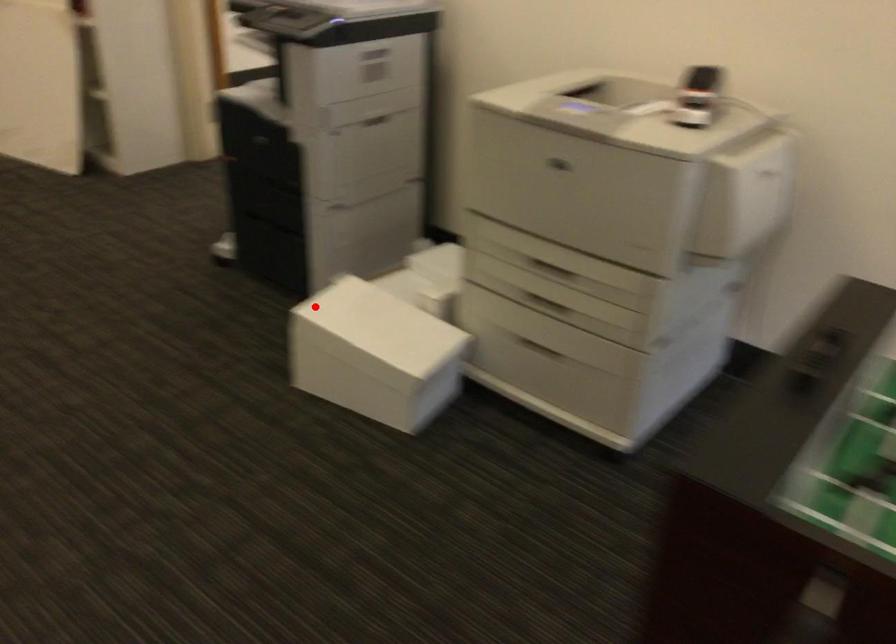
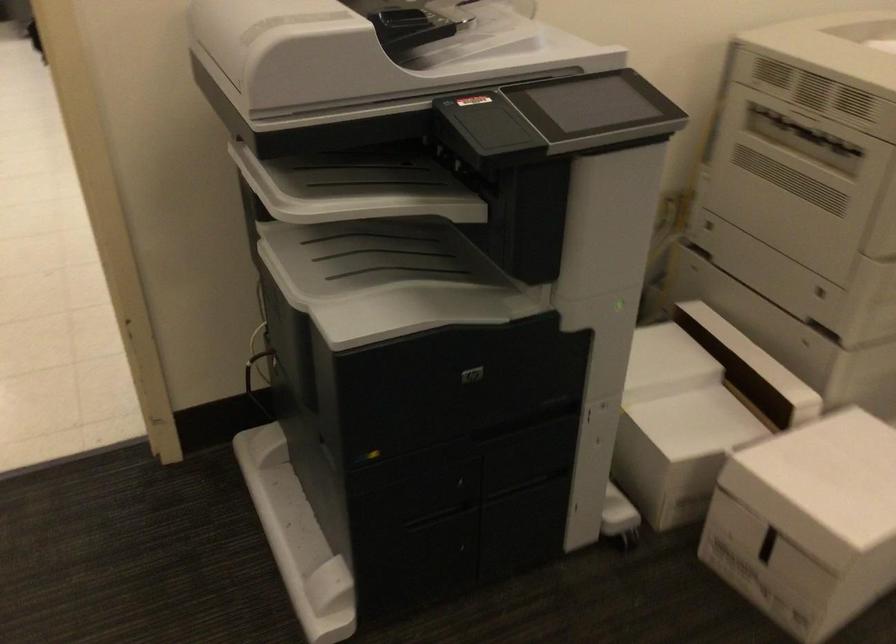
Question: A red point is marked in image1. In image2, is the corresponding 3D point closer to the camera or farther? Reply with the corresponding letter.

Choices:
 (A) The corresponding 3D point is closer.
 (B) The corresponding 3D point is farther.

Answer: (A)